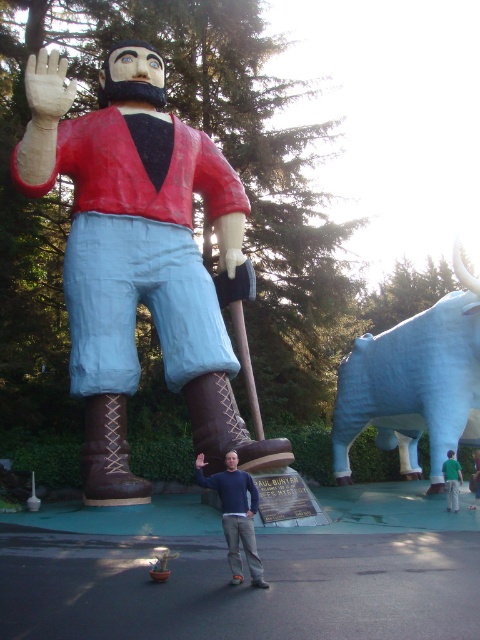
Question: Which point is closer to the camera taking this photo?

Choices:
 (A) (453, 454)
 (B) (124, 230)
 (C) (243, 324)
 (D) (252, 548)

Answer: (D)

Question: From the image, what is the correct spatial relationship of matte papier-mâché figure at center in relation to brown woven fabric pole at center?

Choices:
 (A) above
 (B) below

Answer: (A)

Question: Estimate the real-world distances between objects in this image. Which object is closer to the green fabric shirt at lower center?

Choices:
 (A) blue jeans at center
 (B) green fabric shirt at lower right
 (C) blue fabric bull at right

Answer: (B)

Question: Estimate the real-world distances between objects in this image. Which object is closer to the brown woven fabric pole at center?

Choices:
 (A) blue jeans at center
 (B) blue fabric bull at right
 (C) green fabric shirt at lower right

Answer: (A)

Question: From the image, what is the correct spatial relationship of blue fabric bull at right in relation to green fabric shirt at lower right?

Choices:
 (A) right
 (B) left

Answer: (A)

Question: Where is green fabric shirt at lower center located in relation to green fabric shirt at lower right in the image?

Choices:
 (A) left
 (B) right

Answer: (A)